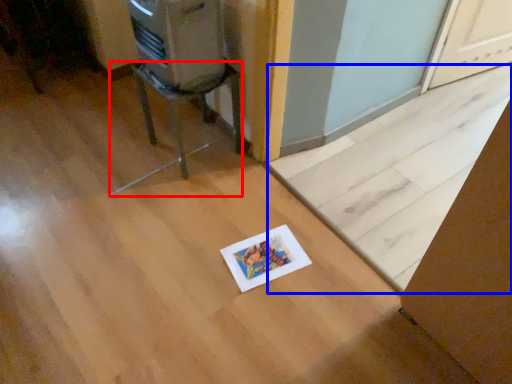
Question: Among these objects, which one is farthest to the camera, furniture (highlighted by a red box) or doormat (highlighted by a blue box)?

Choices:
 (A) furniture
 (B) doormat

Answer: (A)